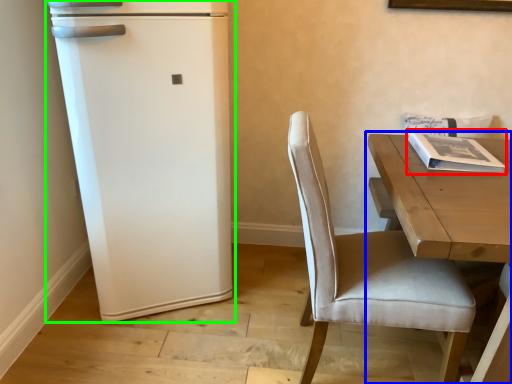
Question: Estimate the real-world distances between objects in this image. Which object is farther from magazine (highlighted by a red box), table (highlighted by a blue box) or refrigerator (highlighted by a green box)?

Choices:
 (A) table
 (B) refrigerator

Answer: (B)